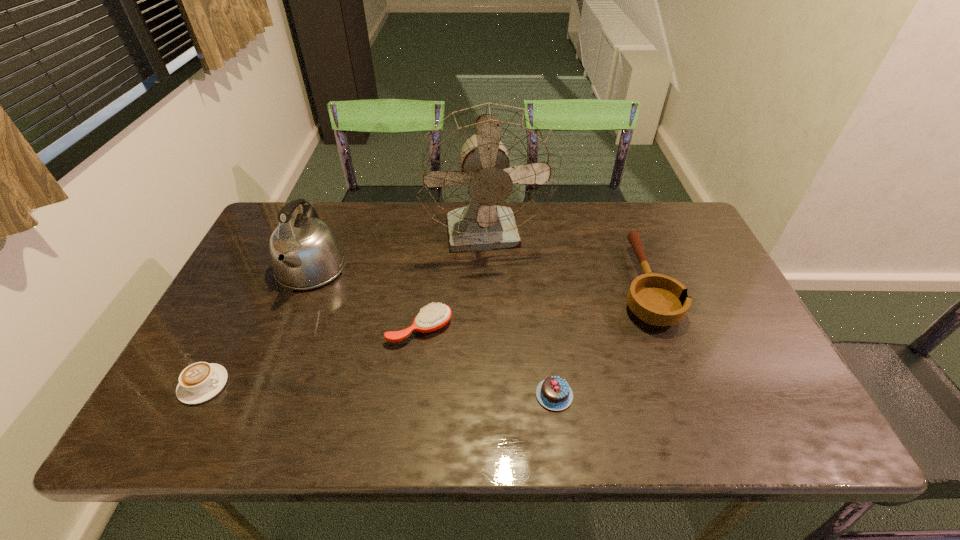
You are a GUI agent. You are given a task and a screenshot of the screen. Output one action in this format:
    pyautogui.click(x=<x>, y=<y>)
    Task: Click on the kettle that is at the left edge
    This screenshot has width=960, height=540.
    Given the screenshot: What is the action you would take?
    pyautogui.click(x=305, y=253)

Image resolution: width=960 pixels, height=540 pixels. I want to click on cappuccino situated at the left edge, so click(x=199, y=382).

Identify the location of object that is at the right edge. The width and height of the screenshot is (960, 540). (656, 299).

This screenshot has height=540, width=960. What are the coordinates of `object at the far left corner` in the screenshot? It's located at (305, 253).

Where is `object present at the near left corner`? The height and width of the screenshot is (540, 960). object present at the near left corner is located at coordinates (199, 382).

In order to click on object that is positioned at the far right corner in this screenshot , I will do `click(656, 299)`.

Where is `vacant space at the far edge`? The height and width of the screenshot is (540, 960). vacant space at the far edge is located at coordinates (390, 206).

The height and width of the screenshot is (540, 960). In the image, there is a desktop. What are the coordinates of `vacant space at the near edge` in the screenshot? It's located at (385, 441).

The image size is (960, 540). Find the location of `vacant area at the left edge of the desktop`. vacant area at the left edge of the desktop is located at coordinates coord(250,342).

Image resolution: width=960 pixels, height=540 pixels. Find the location of `vacant position at the right edge of the desktop`. vacant position at the right edge of the desktop is located at coordinates (708, 373).